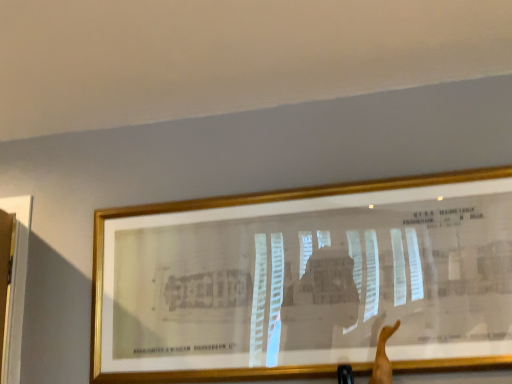
Question: In the image, is skinny tan arm at lower right positioned in front of or behind gold metallic picture frame at upper center?

Choices:
 (A) front
 (B) behind

Answer: (A)

Question: Is skinny tan arm at lower right spatially inside gold metallic picture frame at upper center, or outside of it?

Choices:
 (A) inside
 (B) outside

Answer: (B)

Question: From the image's perspective, is skinny tan arm at lower right above or below gold metallic picture frame at upper center?

Choices:
 (A) below
 (B) above

Answer: (A)

Question: Based on their positions, is gold metallic picture frame at upper center located to the left or right of skinny tan arm at lower right?

Choices:
 (A) left
 (B) right

Answer: (A)

Question: In terms of width, does gold metallic picture frame at upper center look wider or thinner when compared to skinny tan arm at lower right?

Choices:
 (A) wide
 (B) thin

Answer: (A)

Question: Is gold metallic picture frame at upper center bigger or smaller than skinny tan arm at lower right?

Choices:
 (A) big
 (B) small

Answer: (A)

Question: From a real-world perspective, is gold metallic picture frame at upper center physically located above or below skinny tan arm at lower right?

Choices:
 (A) above
 (B) below

Answer: (A)